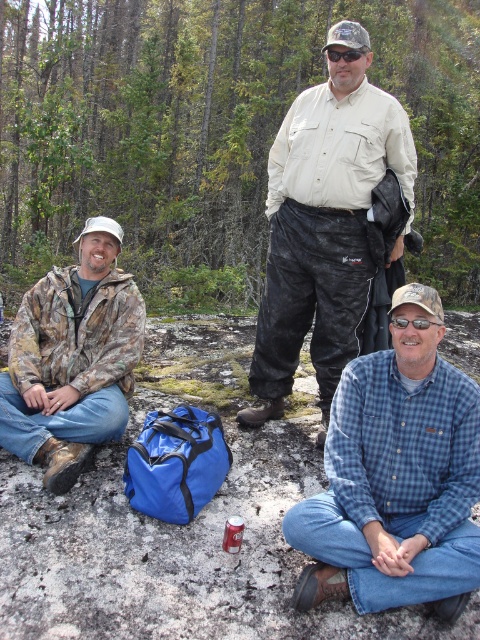
Does khaki cotton shirt at center have a greater width compared to camo jacket at left?

Yes.

Can you confirm if khaki cotton shirt at center is positioned to the left of camo jacket at left?

No, khaki cotton shirt at center is not to the left of camo jacket at left.

Is point (299, 209) closer to viewer compared to point (0, 396)?

No, it is behind (0, 396).

This screenshot has width=480, height=640. I want to click on khaki cotton shirt at center, so click(324, 224).

Who is positioned more to the left, blue plaid shirt at lower right or camo jacket at left?

camo jacket at left is more to the left.

Is blue plaid shirt at lower right to the right of camo jacket at left from the viewer's perspective?

Yes, blue plaid shirt at lower right is to the right of camo jacket at left.

Does point (363, 568) come behind point (23, 348)?

No, (363, 568) is closer to viewer.

Locate an element on the screen. This screenshot has height=640, width=480. blue plaid shirt at lower right is located at coordinates (396, 476).

Is blue plaid shirt at lower right thinner than khaki cotton shirt at center?

Yes, blue plaid shirt at lower right is thinner than khaki cotton shirt at center.

Is blue plaid shirt at lower right smaller than khaki cotton shirt at center?

Indeed, blue plaid shirt at lower right has a smaller size compared to khaki cotton shirt at center.

This screenshot has height=640, width=480. In order to click on blue plaid shirt at lower right in this screenshot , I will do `click(396, 476)`.

Find the location of a particular element. The width and height of the screenshot is (480, 640). blue plaid shirt at lower right is located at coordinates (396, 476).